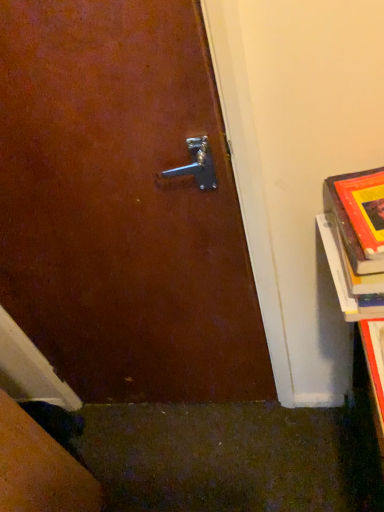
Question: Is hardcover book at lower right to the left or to the right of hardcover book at right in the image?

Choices:
 (A) right
 (B) left

Answer: (B)

Question: Considering their positions, is hardcover book at lower right located in front of or behind hardcover book at right?

Choices:
 (A) behind
 (B) front

Answer: (B)

Question: From a real-world perspective, relative to hardcover book at right, is hardcover book at lower right vertically above or below?

Choices:
 (A) below
 (B) above

Answer: (A)

Question: Is hardcover book at right in front of or behind hardcover book at lower right in the image?

Choices:
 (A) front
 (B) behind

Answer: (B)

Question: Is point (337, 192) positioned closer to the camera than point (377, 403)?

Choices:
 (A) farther
 (B) closer

Answer: (B)

Question: Is hardcover book at right bigger or smaller than hardcover book at lower right?

Choices:
 (A) small
 (B) big

Answer: (B)

Question: Based on their positions, is hardcover book at right located to the left or right of hardcover book at lower right?

Choices:
 (A) right
 (B) left

Answer: (A)